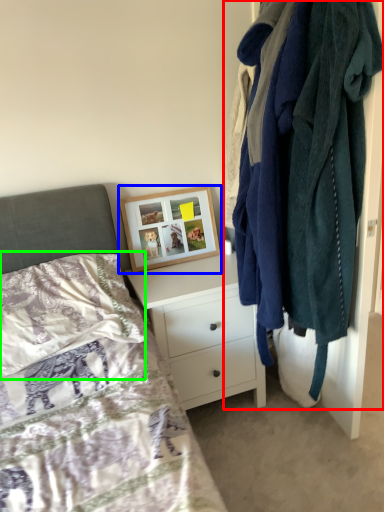
Question: Which is farther away from closet (highlighted by a red box)? picture frame (highlighted by a blue box) or pillow (highlighted by a green box)?

Choices:
 (A) picture frame
 (B) pillow

Answer: (B)